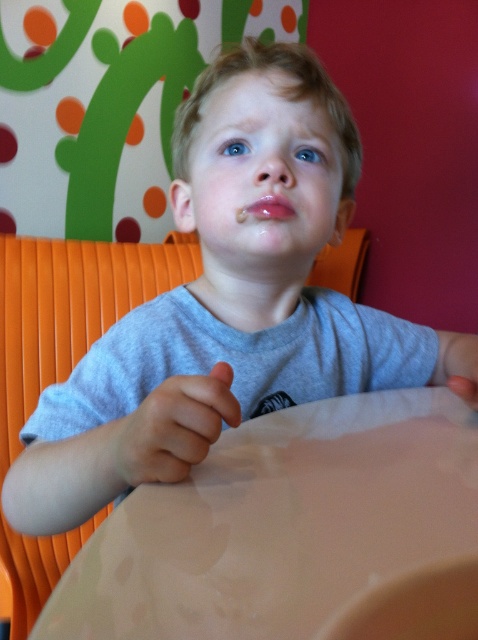
You are a parent trying to clean up after your child. You need to move the white glossy table at center to access the orange plastic chair at center. Is the table in the way of the chair?

The white glossy table at center is below the orange plastic chair at center, so the table is directly underneath the chair. This means the table is blocking access to the chair from above, so yes, the table is in the way of the chair.

You are a parent observing your child at the table. You notice two hands near the center of the scene. Which hand is positioned lower between the smooth skin hand at center and the smooth skin hand at lower center?

The smooth skin hand at center is positioned lower than the smooth skin hand at lower center because it is described as being below it.